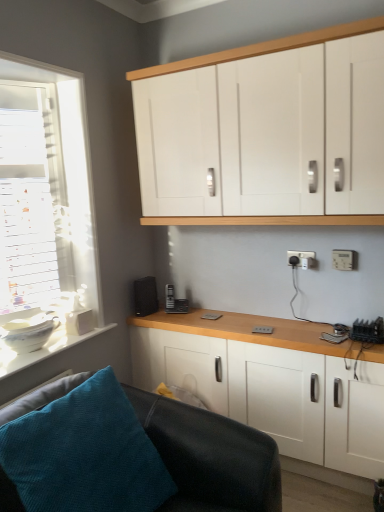
Question: Is black matte speaker at lower left smaller than white matte cabinet at upper center, arranged as the 2th cabinetry when ordered from the bottom?

Choices:
 (A) no
 (B) yes

Answer: (B)

Question: From a real-world perspective, is black matte speaker at lower left over white matte cabinet at upper center, arranged as the 2th cabinetry when ordered from the bottom?

Choices:
 (A) no
 (B) yes

Answer: (A)

Question: Is black matte speaker at lower left wider than white matte cabinet at upper center, arranged as the 2th cabinetry when ordered from the bottom?

Choices:
 (A) yes
 (B) no

Answer: (B)

Question: Does black matte speaker at lower left turn towards white matte cabinet at upper center, arranged as the 2th cabinetry when ordered from the bottom?

Choices:
 (A) yes
 (B) no

Answer: (B)

Question: Is black matte speaker at lower left facing away from white matte cabinet at upper center, arranged as the 2th cabinetry when ordered from the bottom?

Choices:
 (A) no
 (B) yes

Answer: (A)

Question: Relative to black leather couch at lower left, is white plastic electric outlet at lower right, the 1th electric outlet when ordered from right to left, in front or behind?

Choices:
 (A) front
 (B) behind

Answer: (B)

Question: In terms of width, does white plastic electric outlet at lower right, the second electric outlet from the left, look wider or thinner when compared to black leather couch at lower left?

Choices:
 (A) thin
 (B) wide

Answer: (A)

Question: From their relative heights in the image, would you say white plastic electric outlet at lower right, the 1th electric outlet when ordered from right to left, is taller or shorter than black leather couch at lower left?

Choices:
 (A) short
 (B) tall

Answer: (A)

Question: Is white plastic electric outlet at lower right, the second electric outlet from the left, situated inside black leather couch at lower left or outside?

Choices:
 (A) inside
 (B) outside

Answer: (B)

Question: Choose the correct answer: Is white matte cabinet at lower center, the 2th cabinetry viewed from the top, inside white plastic socket at upper right, which is counted as the 2th electric outlet, starting from the front, or outside it?

Choices:
 (A) inside
 (B) outside

Answer: (B)

Question: Considering their positions, is white matte cabinet at lower center, acting as the first cabinetry starting from the bottom, located in front of or behind white plastic socket at upper right, which appears as the first electric outlet when viewed from the back?

Choices:
 (A) front
 (B) behind

Answer: (A)

Question: From a real-world perspective, is white matte cabinet at lower center, acting as the first cabinetry starting from the bottom, above or below white plastic socket at upper right, placed as the 2th electric outlet when sorted from right to left?

Choices:
 (A) above
 (B) below

Answer: (B)

Question: From their relative heights in the image, would you say white matte cabinet at lower center, acting as the first cabinetry starting from the bottom, is taller or shorter than white plastic socket at upper right, which appears as the first electric outlet when viewed from the back?

Choices:
 (A) tall
 (B) short

Answer: (A)

Question: Is white matte cabinet at lower center, the 2th cabinetry viewed from the top, inside the boundaries of black leather couch at lower left, or outside?

Choices:
 (A) inside
 (B) outside

Answer: (B)

Question: Considering their positions, is white matte cabinet at lower center, the 2th cabinetry viewed from the top, located in front of or behind black leather couch at lower left?

Choices:
 (A) front
 (B) behind

Answer: (B)